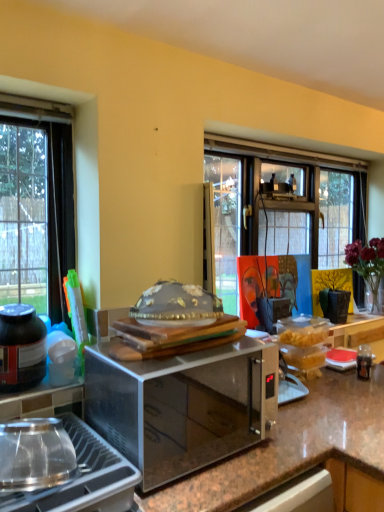
Question: Are orange canvas painting at center and black matte jar at lower left located far from each other?

Choices:
 (A) no
 (B) yes

Answer: (B)

Question: From a real-world perspective, is orange canvas painting at center physically below black matte jar at lower left?

Choices:
 (A) no
 (B) yes

Answer: (A)

Question: Is orange canvas painting at center positioned in front of black matte jar at lower left?

Choices:
 (A) no
 (B) yes

Answer: (A)

Question: Is orange canvas painting at center at the right side of black matte jar at lower left?

Choices:
 (A) no
 (B) yes

Answer: (B)

Question: Considering the relative sizes of orange canvas painting at center and black matte jar at lower left in the image provided, is orange canvas painting at center wider than black matte jar at lower left?

Choices:
 (A) no
 (B) yes

Answer: (B)

Question: Is translucent glass vase at upper right in front of or behind black matte jar at lower left in the image?

Choices:
 (A) front
 (B) behind

Answer: (B)

Question: Would you say translucent glass vase at upper right is inside or outside black matte jar at lower left?

Choices:
 (A) inside
 (B) outside

Answer: (B)

Question: Is translucent glass vase at upper right to the left or to the right of black matte jar at lower left in the image?

Choices:
 (A) right
 (B) left

Answer: (A)

Question: From a real-world perspective, is translucent glass vase at upper right physically located above or below black matte jar at lower left?

Choices:
 (A) below
 (B) above

Answer: (B)

Question: In terms of width, does satin metallic microwave at center look wider or thinner when compared to black matte jar at lower left?

Choices:
 (A) wide
 (B) thin

Answer: (A)

Question: From the image's perspective, is satin metallic microwave at center positioned above or below black matte jar at lower left?

Choices:
 (A) below
 (B) above

Answer: (A)

Question: From a real-world perspective, is satin metallic microwave at center physically located above or below black matte jar at lower left?

Choices:
 (A) below
 (B) above

Answer: (A)

Question: Do you think satin metallic microwave at center is within black matte jar at lower left, or outside of it?

Choices:
 (A) inside
 (B) outside

Answer: (B)

Question: Looking at the image, does brown granite countertop at center seem bigger or smaller compared to black matte jar at lower left?

Choices:
 (A) small
 (B) big

Answer: (B)

Question: Does point (382, 460) appear closer or farther from the camera than point (0, 320)?

Choices:
 (A) closer
 (B) farther

Answer: (A)